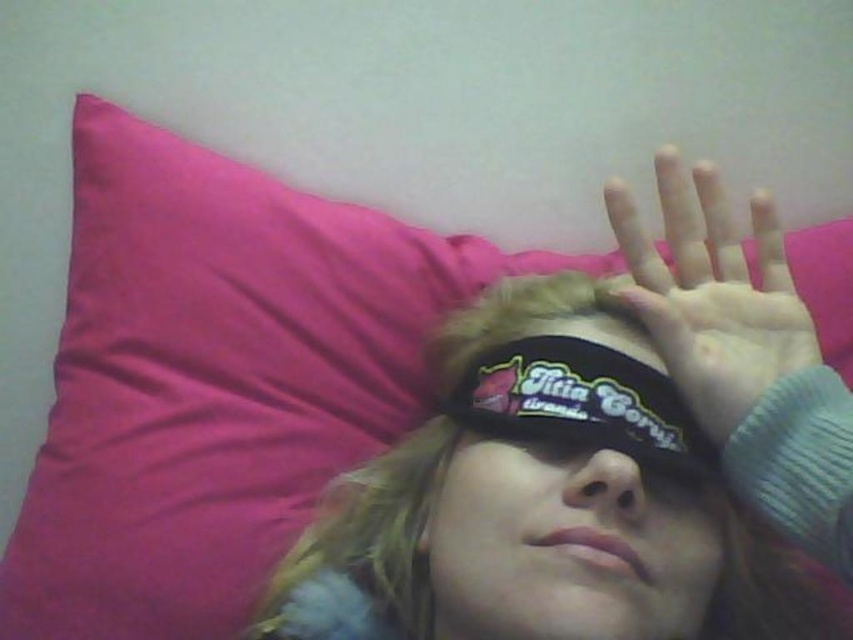
Question: Which object is closer to the camera taking this photo?

Choices:
 (A) black fabric eye mask at center
 (B) black fabric blindfold at center
 (C) matte black hand at upper right

Answer: (B)

Question: Is matte black hand at upper right closer to the viewer compared to black fabric eye mask at center?

Choices:
 (A) no
 (B) yes

Answer: (A)

Question: Which point appears closest to the camera in this image?

Choices:
 (A) (531, 323)
 (B) (674, 368)

Answer: (B)

Question: Does matte black hand at upper right have a smaller size compared to black fabric eye mask at center?

Choices:
 (A) no
 (B) yes

Answer: (A)

Question: Which is nearer to the black fabric blindfold at center?

Choices:
 (A) matte black hand at upper right
 (B) black fabric eye mask at center

Answer: (B)

Question: Can you confirm if black fabric blindfold at center is bigger than black fabric eye mask at center?

Choices:
 (A) no
 (B) yes

Answer: (B)